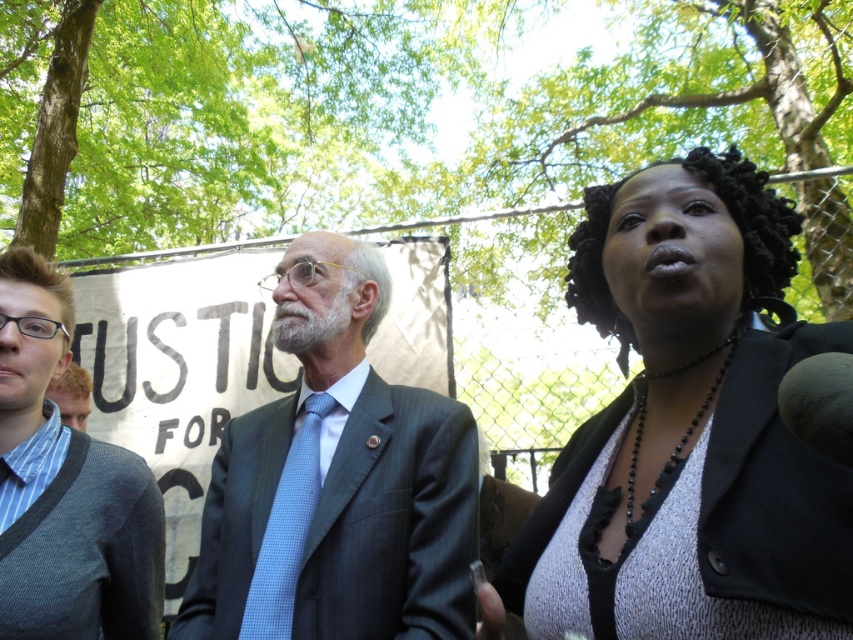
Question: Does dark gray suit at center appear on the left side of light blue textured tie at center?

Choices:
 (A) yes
 (B) no

Answer: (B)

Question: Which of the following is the closest to the observer?

Choices:
 (A) (24, 404)
 (B) (680, 225)
 (C) (308, 376)
 (D) (285, 474)

Answer: (B)

Question: Can you confirm if light blue textured sweater at left is positioned above blonde hair at left?

Choices:
 (A) no
 (B) yes

Answer: (A)

Question: Which object is farther from the camera taking this photo?

Choices:
 (A) blonde hair at left
 (B) dark gray suit at center
 (C) black textured hair at upper right
 (D) light blue textured sweater at left

Answer: (A)

Question: Considering the real-world distances, which object is farthest from the blonde hair at left?

Choices:
 (A) light blue textured tie at center
 (B) black textured hair at upper right
 (C) light blue textured sweater at left
 (D) dark gray suit at center

Answer: (B)

Question: Where is black textured hair at upper right located in relation to light blue textured tie at center in the image?

Choices:
 (A) below
 (B) above

Answer: (B)